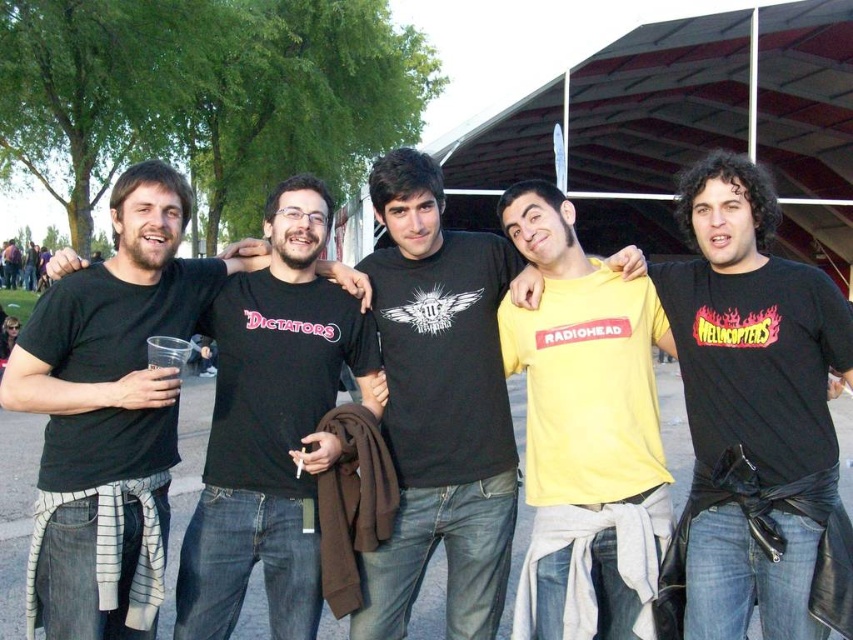
Question: Does yellow matte shirt at center have a larger size compared to yellow matte t-shirt at center?

Choices:
 (A) yes
 (B) no

Answer: (B)

Question: Is yellow matte shirt at center to the left of yellow matte t-shirt at center from the viewer's perspective?

Choices:
 (A) yes
 (B) no

Answer: (B)

Question: Which point is closer to the camera?

Choices:
 (A) yellow matte shirt at center
 (B) yellow matte t-shirt at center

Answer: (A)

Question: Does yellow matte t-shirt at center appear over black matte t-shirt at left?

Choices:
 (A) no
 (B) yes

Answer: (B)

Question: Which point appears farthest from the camera in this image?

Choices:
 (A) (248, 552)
 (B) (807, 445)
 (C) (479, 538)

Answer: (C)

Question: Which point is closer to the camera?

Choices:
 (A) yellow matte t-shirt at center
 (B) black matte t-shirt at left
 (C) yellow matte shirt at center

Answer: (C)